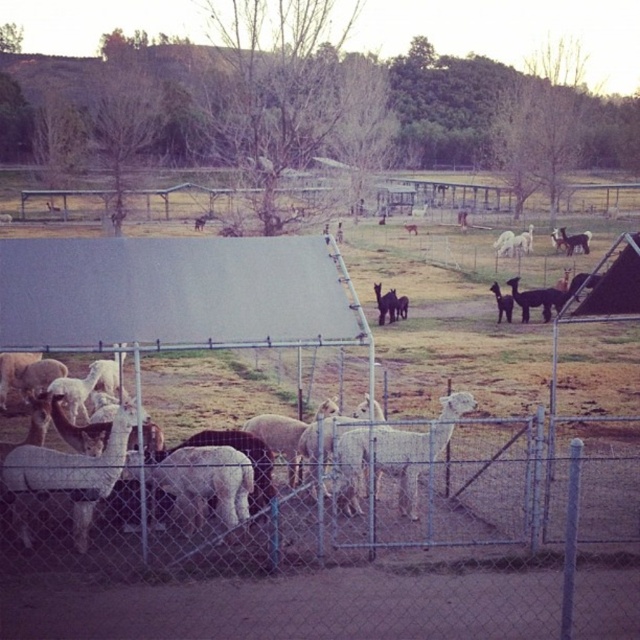
Who is more forward, (44, 484) or (358, 458)?

Point (44, 484) is more forward.

Who is positioned more to the right, white woolly alpaca at lower left or white woolly alpaca at center?

Positioned to the right is white woolly alpaca at center.

Which is in front, point (84, 540) or point (392, 435)?

Point (84, 540) is more forward.

Image resolution: width=640 pixels, height=640 pixels. Find the location of `white woolly alpaca at lower left`. white woolly alpaca at lower left is located at coordinates (67, 476).